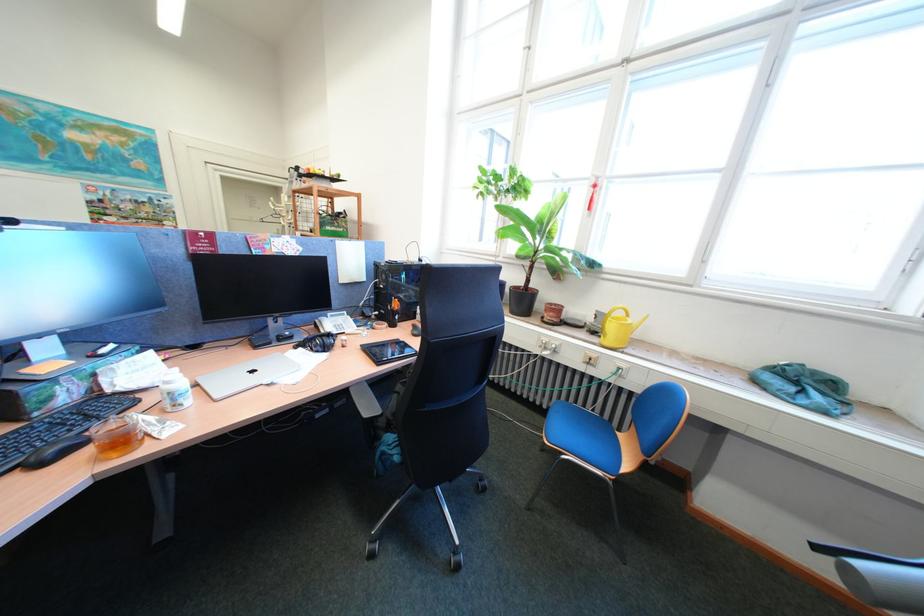
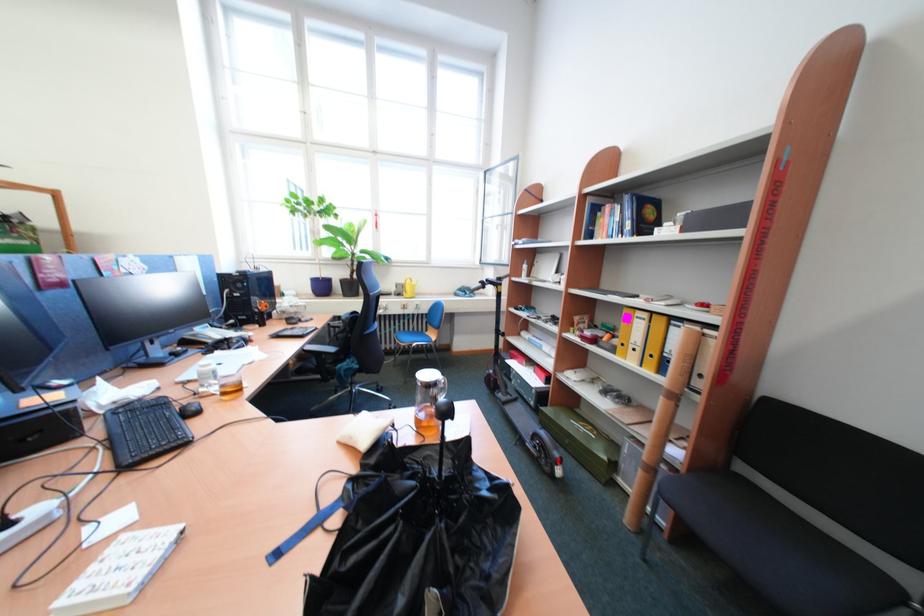
Find the pixel in the second image that matches pixel 594 329 in the first image.

(403, 296)